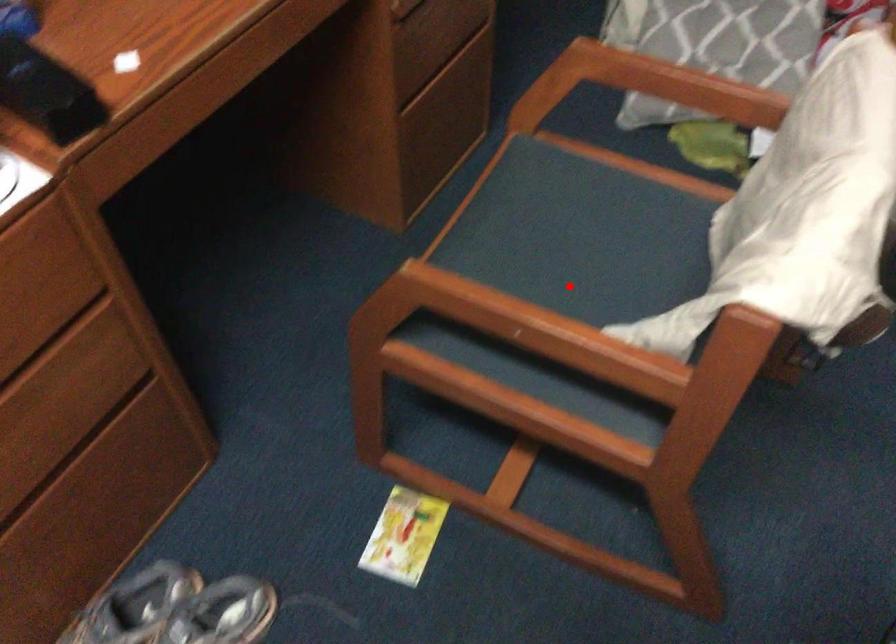
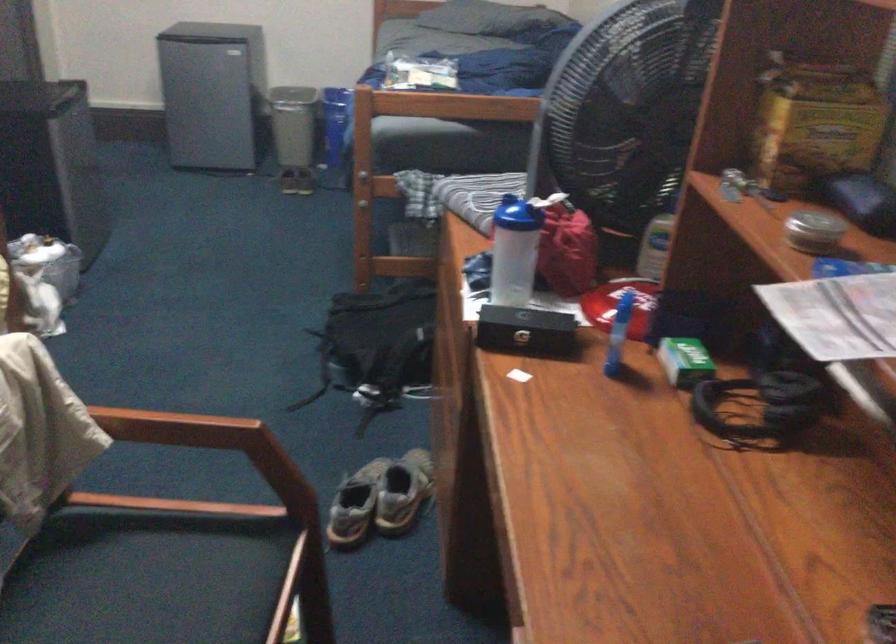
Locate, in the second image, the point that corresponds to the highlighted location in the first image.

(162, 579)